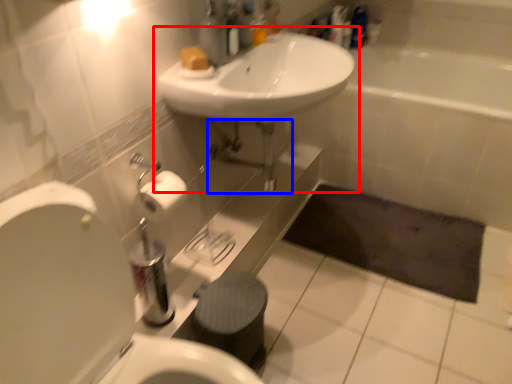
Question: Which point is further to the camera, sink (highlighted by a red box) or plumbing fixture (highlighted by a blue box)?

Choices:
 (A) sink
 (B) plumbing fixture

Answer: (B)